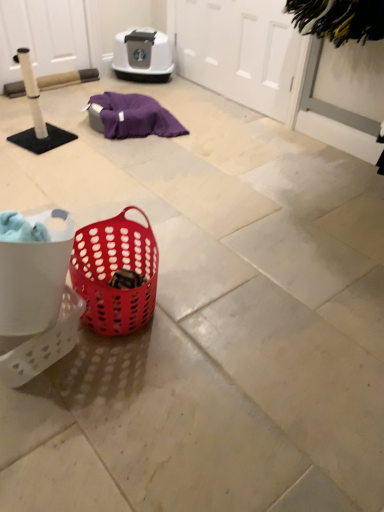
Question: Considering the positions of white perforated basket at lower left and white matte screen door at upper center, placed as the 2th screen door when sorted from left to right, in the image, is white perforated basket at lower left taller or shorter than white matte screen door at upper center, placed as the 2th screen door when sorted from left to right,?

Choices:
 (A) short
 (B) tall

Answer: (A)

Question: From a real-world perspective, is white perforated basket at lower left positioned above or below white matte screen door at upper center, arranged as the 1th screen door when viewed from the right?

Choices:
 (A) below
 (B) above

Answer: (A)

Question: Estimate the real-world distances between objects in this image. Which object is closer to the black fuzzy brush at upper right?

Choices:
 (A) white matte screen door at upper left, the second screen door viewed from the right
 (B) white perforated basket at lower left
 (C) matte plastic basket at center
 (D) white matte screen door at upper center, placed as the 2th screen door when sorted from left to right

Answer: (D)

Question: Considering the real-world distances, which object is farthest from the black fuzzy brush at upper right?

Choices:
 (A) white perforated basket at lower left
 (B) white matte screen door at upper center, placed as the 2th screen door when sorted from left to right
 (C) matte plastic basket at center
 (D) white matte screen door at upper left, the second screen door viewed from the right

Answer: (D)